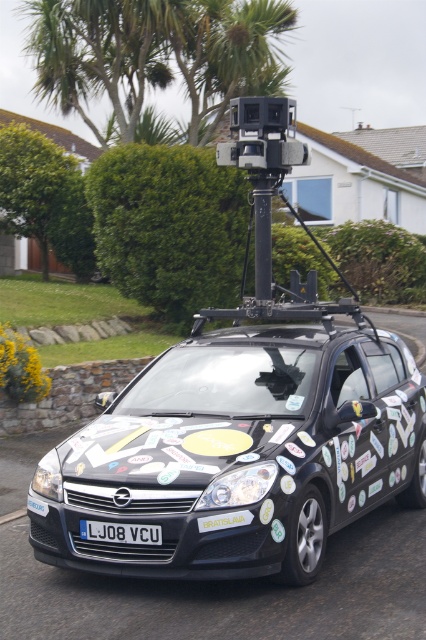
You are a pedestrian standing on the sidewalk and see the black Opel car with its camera system. Which object, the black plastic pole at center or the black plastic license plate at center, is located to the right of the other?

The black plastic pole at center is positioned on the right side of black plastic license plate at center.